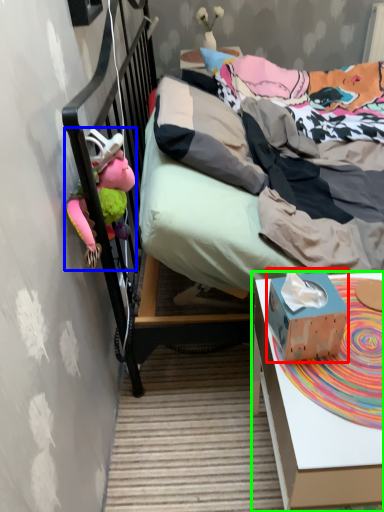
Question: Estimate the real-world distances between objects in this image. Which object is farther from box (highlighted by a red box), toy (highlighted by a blue box) or desk (highlighted by a green box)?

Choices:
 (A) toy
 (B) desk

Answer: (A)